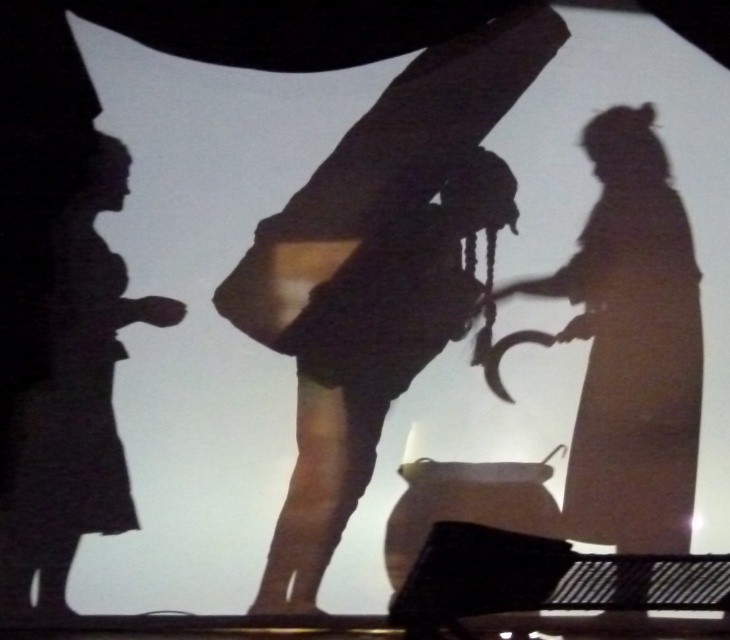
Question: Among these objects, which one is nearest to the camera?

Choices:
 (A) black matte figure at left
 (B) silhouette figure at center

Answer: (A)

Question: Can you confirm if silhouette figure at center is thinner than black matte figure at left?

Choices:
 (A) yes
 (B) no

Answer: (B)

Question: In this image, where is silhouette figure at center located relative to black matte figure at left?

Choices:
 (A) below
 (B) above

Answer: (B)

Question: Does silhouette figure at center appear on the right side of black matte figure at left?

Choices:
 (A) yes
 (B) no

Answer: (A)